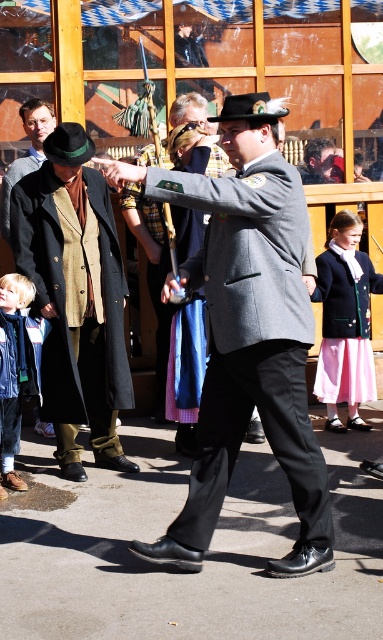
Who is positioned more to the right, matte gray uniform at center or matte gray coat at center?

From the viewer's perspective, matte gray uniform at center appears more on the right side.

Between matte gray uniform at center and matte gray coat at center, which one appears on the left side from the viewer's perspective?

matte gray coat at center

Identify the location of matte gray uniform at center. (248, 332).

Does matte brown coat at left have a smaller size compared to matte black blazer at center?

No, matte brown coat at left is not smaller than matte black blazer at center.

This screenshot has width=383, height=640. I want to click on matte brown coat at left, so click(75, 298).

At what (x,y) coordinates should I click in order to perform the action: click on matte brown coat at left. Please return your answer as a coordinate pair (x, y). The width and height of the screenshot is (383, 640). Looking at the image, I should click on (75, 298).

Who is taller, matte brown coat at left or brown wool coat at left?

matte brown coat at left is taller.

The image size is (383, 640). Describe the element at coordinates (75, 298) in the screenshot. I see `matte brown coat at left` at that location.

Locate an element on the screen. This screenshot has height=640, width=383. matte brown coat at left is located at coordinates (75, 298).